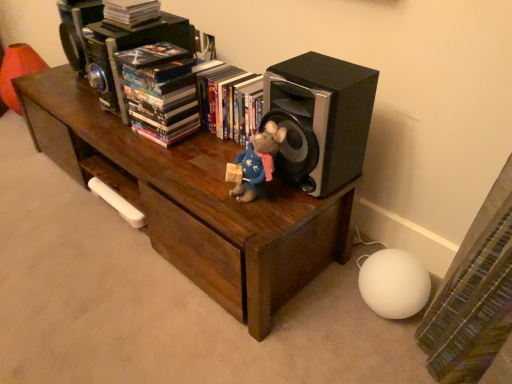
Question: Does hardcover book at center, the third book from the left, have a smaller size compared to matte black book at upper center, the first book positioned from the left?

Choices:
 (A) no
 (B) yes

Answer: (A)

Question: Can you confirm if hardcover book at center, the third book from the left, is positioned to the right of matte black book at upper center, the first book positioned from the left?

Choices:
 (A) yes
 (B) no

Answer: (A)

Question: Can matte black book at upper center, the 3th book in the right-to-left sequence, be found inside hardcover book at center, arranged as the first book when viewed from the right?

Choices:
 (A) yes
 (B) no

Answer: (B)

Question: From the image's perspective, is hardcover book at center, the third book from the left, below matte black book at upper center, the first book positioned from the left?

Choices:
 (A) yes
 (B) no

Answer: (A)

Question: Considering the relative sizes of hardcover book at center, arranged as the first book when viewed from the right, and matte black book at upper center, the first book positioned from the left, in the image provided, is hardcover book at center, arranged as the first book when viewed from the right, bigger than matte black book at upper center, the first book positioned from the left,?

Choices:
 (A) yes
 (B) no

Answer: (A)

Question: Is hardcover book at center, arranged as the first book when viewed from the right, outside matte black book at upper center, the first book positioned from the left?

Choices:
 (A) yes
 (B) no

Answer: (A)

Question: Does multicolored paperbacks at upper center, positioned as the second book in right-to-left order, come in front of velvety blue plush at center?

Choices:
 (A) no
 (B) yes

Answer: (A)

Question: Does multicolored paperbacks at upper center, the 2th book when ordered from left to right, have a greater height compared to velvety blue plush at center?

Choices:
 (A) no
 (B) yes

Answer: (B)

Question: Can you confirm if multicolored paperbacks at upper center, positioned as the second book in right-to-left order, is bigger than velvety blue plush at center?

Choices:
 (A) no
 (B) yes

Answer: (B)

Question: From the image's perspective, is multicolored paperbacks at upper center, positioned as the second book in right-to-left order, located beneath velvety blue plush at center?

Choices:
 (A) yes
 (B) no

Answer: (B)

Question: From the image's perspective, is multicolored paperbacks at upper center, positioned as the second book in right-to-left order, over velvety blue plush at center?

Choices:
 (A) no
 (B) yes

Answer: (B)

Question: Is the position of multicolored paperbacks at upper center, the 2th book when ordered from left to right, more distant than that of velvety blue plush at center?

Choices:
 (A) yes
 (B) no

Answer: (A)

Question: Can you confirm if multicolored paperbacks at upper center, the 2th book when ordered from left to right, is shorter than hardcover book at center, the third book from the left?

Choices:
 (A) yes
 (B) no

Answer: (B)